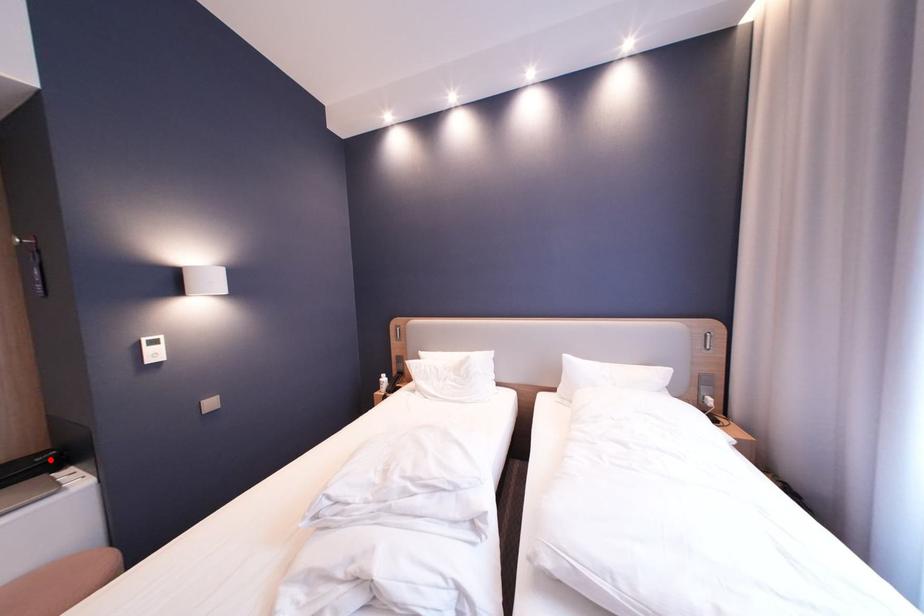
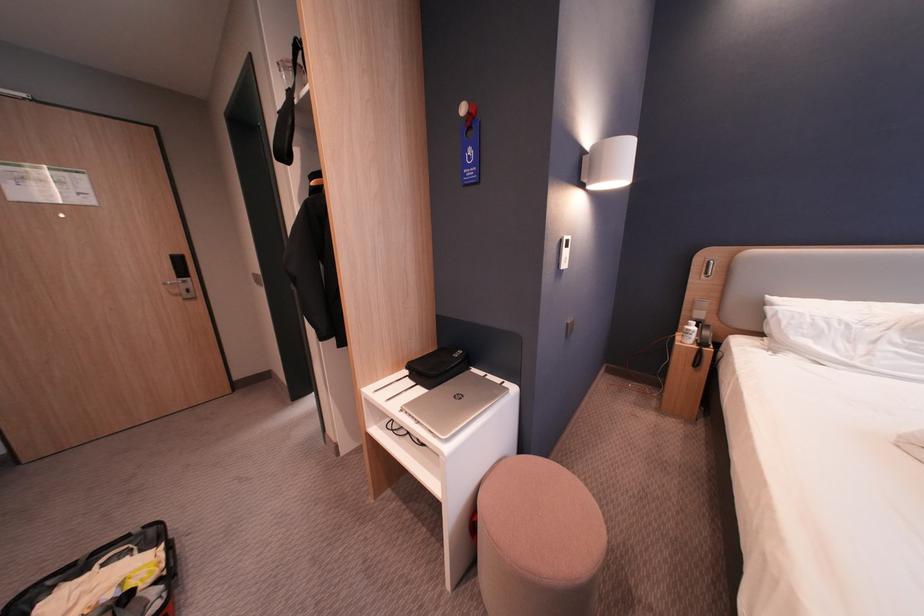
Question: I am providing you with two images of the same scene from different viewpoints. Given a red point in image1, look at the same physical point in image2. Is it:

Choices:
 (A) Closer to the viewpoint
 (B) Farther from the viewpoint

Answer: (B)